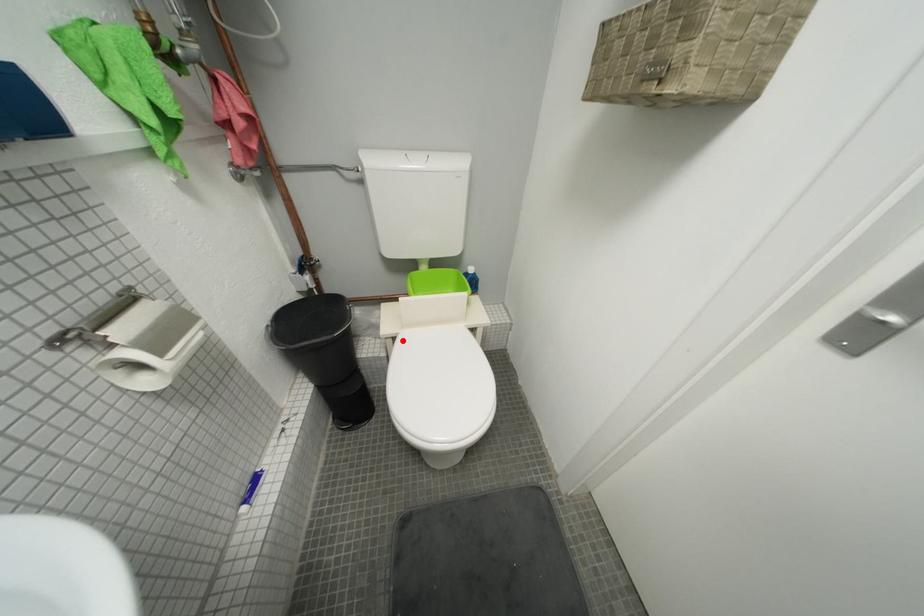
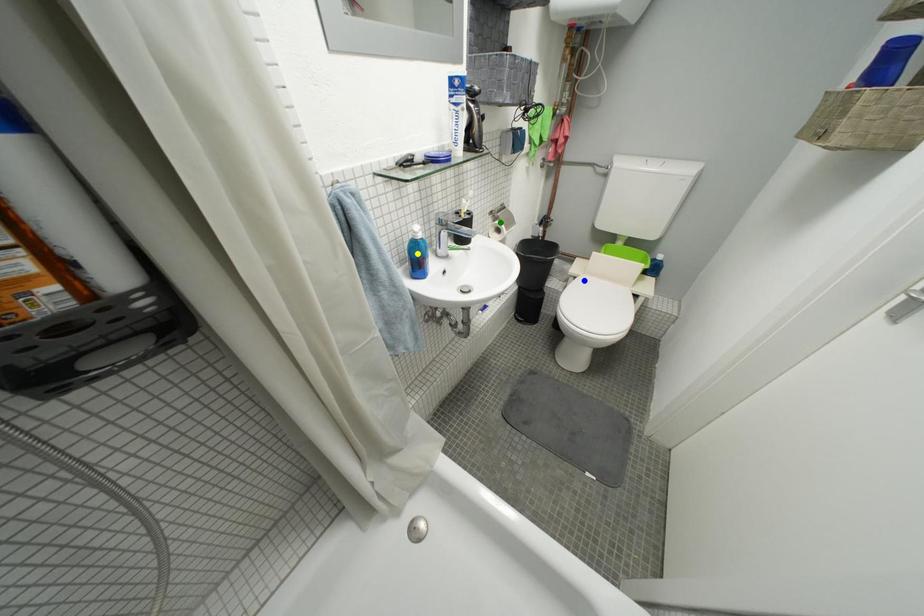
Question: I am providing you with two images of the same scene from different viewpoints. A red point is marked on the first image. You are given multiple points on the second image. Which mark in image 2 goes with the point in image 1?

Choices:
 (A) green point
 (B) blue point
 (C) yellow point

Answer: (B)